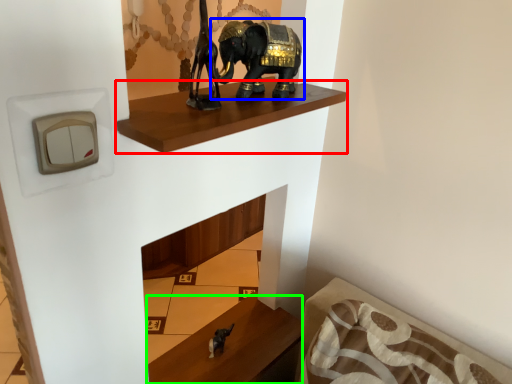
Question: Which is farther away from shelf (highlighted by a red box)? elephant (highlighted by a blue box) or furniture (highlighted by a green box)?

Choices:
 (A) elephant
 (B) furniture

Answer: (B)